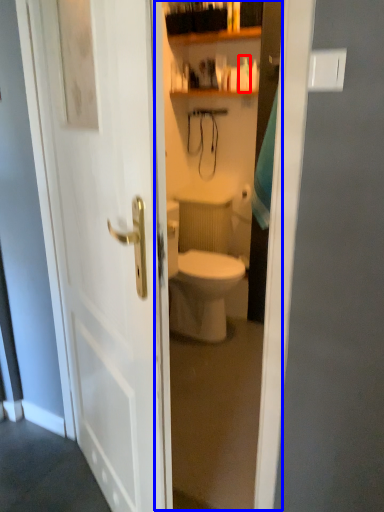
Question: Which of the following is the farthest to the observer, toiletry (highlighted by a red box) or glass door (highlighted by a blue box)?

Choices:
 (A) toiletry
 (B) glass door

Answer: (A)